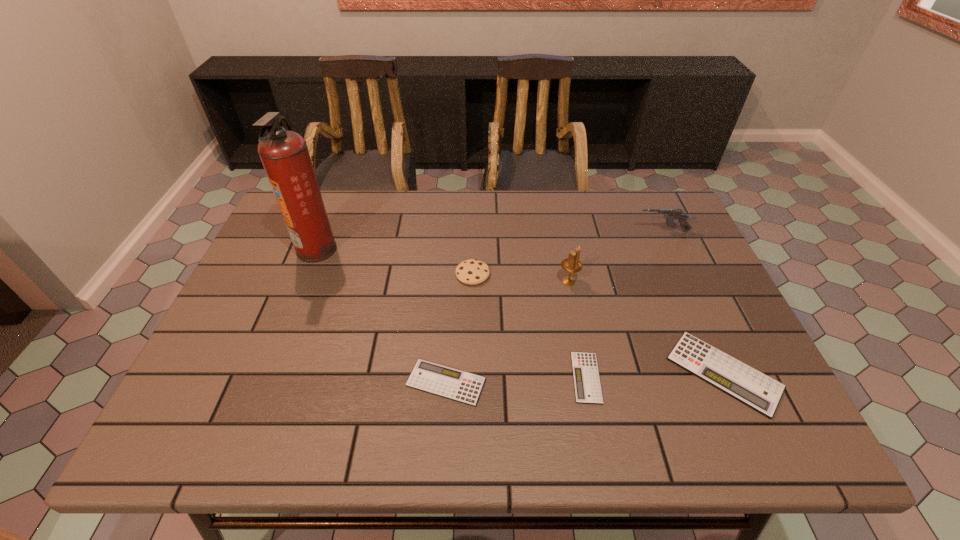
Locate an element on the screen. Image resolution: width=960 pixels, height=540 pixels. the sixth shortest object is located at coordinates (571, 264).

Identify the location of blank space located 0.350m on the left of the leftmost calculator. The height and width of the screenshot is (540, 960). (246, 382).

In order to click on free space located 0.170m on the back of the shortest calculator in this screenshot , I will do `click(570, 298)`.

I want to click on free space located 0.300m on the left of the rightmost calculator, so (537, 373).

I want to click on free point located 0.270m at the barrel of the gun, so click(545, 232).

Where is `vacant region located at the barrel of the gun`? vacant region located at the barrel of the gun is located at coordinates (605, 232).

Identify the location of free space located 0.330m at the barrel of the gun. (525, 232).

You are a GUI agent. You are given a task and a screenshot of the screen. Output one action in this format:
    pyautogui.click(x=<x>, y=<y>)
    Task: Click on the free space located at the nozzle of the leftmost object
    
    Given the screenshot: What is the action you would take?
    pyautogui.click(x=430, y=249)

Where is `free space located 0.370m on the left of the fourth tallest object`? This screenshot has width=960, height=540. free space located 0.370m on the left of the fourth tallest object is located at coordinates (320, 274).

What are the coordinates of `free space located 0.250m on the front of the sixth shortest object` in the screenshot? It's located at (587, 370).